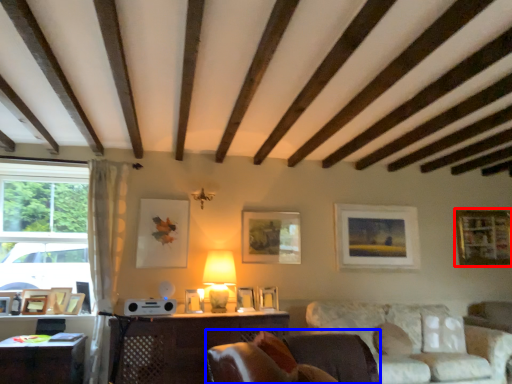
Question: Which point is further to the camera, picture frame (highlighted by a red box) or rocking chair (highlighted by a blue box)?

Choices:
 (A) picture frame
 (B) rocking chair

Answer: (A)